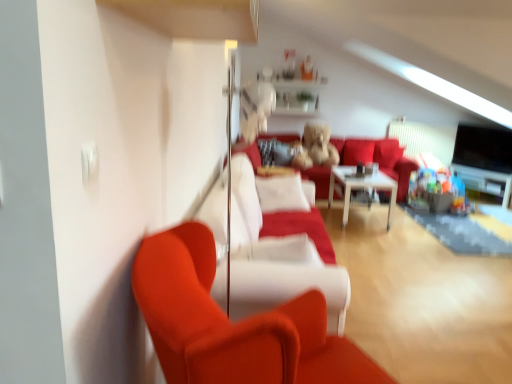
Question: From the image's perspective, relative to white glossy shelf at upper center, is matte red couch at left above or below?

Choices:
 (A) above
 (B) below

Answer: (B)

Question: Looking at the image, does matte red couch at left seem bigger or smaller compared to white glossy shelf at upper center?

Choices:
 (A) small
 (B) big

Answer: (B)

Question: Estimate the real-world distances between objects in this image. Which object is closer to the white glossy shelf at upper center?

Choices:
 (A) velvet red couch at center, the second couch viewed from the back
 (B) white glossy table at center
 (C) velvet red couch at center, placed as the first couch when sorted from back to front
 (D) matte red couch at left

Answer: (C)

Question: Estimate the real-world distances between objects in this image. Which object is closer to the matte red couch at left?

Choices:
 (A) velvet red couch at center, placed as the first couch when sorted from back to front
 (B) white glossy table at center
 (C) velvet red couch at center, the second couch viewed from the back
 (D) white glossy shelf at upper center

Answer: (C)